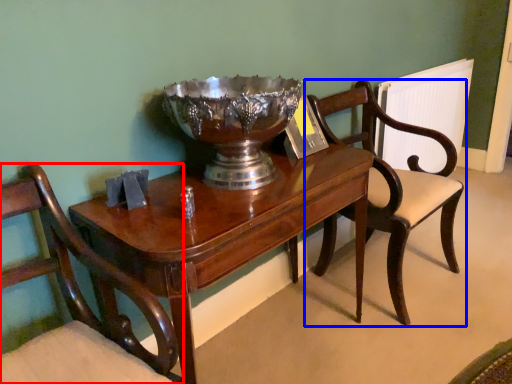
Question: Which object appears farthest to the camera in this image, chair (highlighted by a red box) or chair (highlighted by a blue box)?

Choices:
 (A) chair
 (B) chair

Answer: (B)